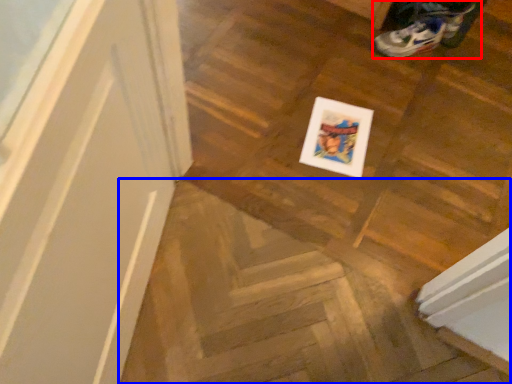
Question: Which point is further to the camera, footwear (highlighted by a red box) or stairwell (highlighted by a blue box)?

Choices:
 (A) footwear
 (B) stairwell

Answer: (A)